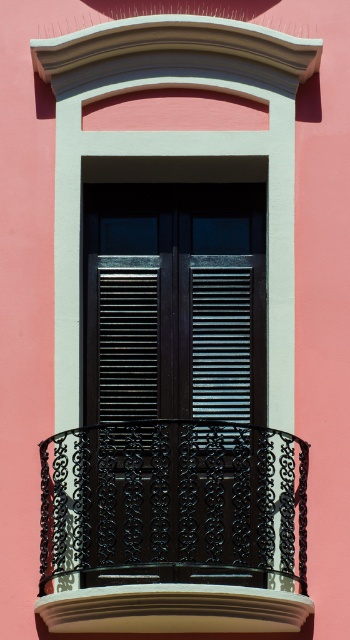
Question: Which point appears farthest from the camera in this image?

Choices:
 (A) (101, 376)
 (B) (240, 364)
 (C) (278, 560)

Answer: (B)

Question: Does black matte shutters at center appear under metallic dark gray shutter at center?

Choices:
 (A) no
 (B) yes

Answer: (A)

Question: Observing the image, what is the correct spatial positioning of black matte shutters at center in reference to metallic dark gray shutter at center?

Choices:
 (A) right
 (B) left

Answer: (B)

Question: Estimate the real-world distances between objects in this image. Which object is closer to the metallic dark gray shutter at center?

Choices:
 (A) black matte shutters at center
 (B) black wrought iron balcony at center

Answer: (A)

Question: From the image, what is the correct spatial relationship of black matte shutters at center in relation to metallic dark gray shutter at center?

Choices:
 (A) below
 (B) above

Answer: (B)

Question: Which point appears closest to the camera in this image?

Choices:
 (A) (x=137, y=541)
 (B) (x=212, y=278)
 (C) (x=131, y=317)

Answer: (A)